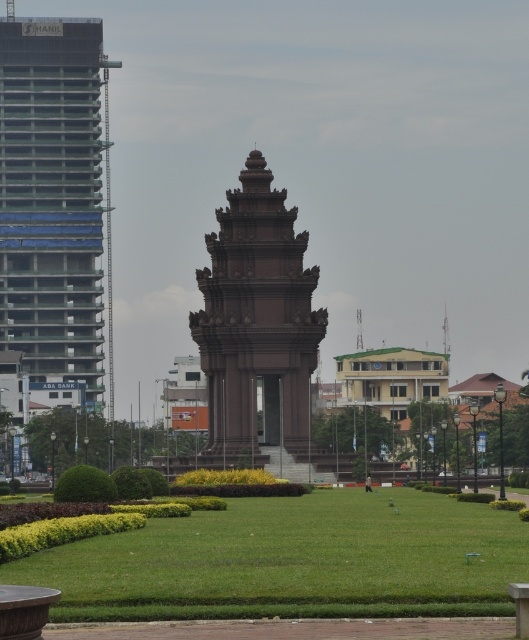
Question: Does green grass at center have a lesser width compared to concrete building at left?

Choices:
 (A) no
 (B) yes

Answer: (A)

Question: Is concrete building at left smaller than brown stone tower at center?

Choices:
 (A) yes
 (B) no

Answer: (A)

Question: Which object is the farthest from the concrete building at left?

Choices:
 (A) green grass at center
 (B) brown stone tower at center

Answer: (A)

Question: Observing the image, what is the correct spatial positioning of green grass at center in reference to concrete building at left?

Choices:
 (A) below
 (B) above

Answer: (A)

Question: Which of the following is the farthest from the observer?

Choices:
 (A) (271, 288)
 (B) (90, 40)
 (C) (223, 560)

Answer: (B)

Question: Which point is farther to the camera?

Choices:
 (A) (415, 561)
 (B) (290, 273)
 (C) (35, 308)

Answer: (C)